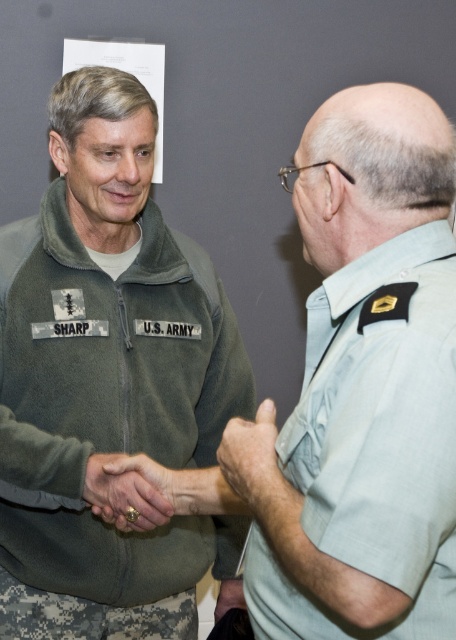
You are a photographer taking a closeup shot of the handshake between the two individuals. You need to focus on the gold ring at center and the matte gray hand at lower center. Which object is closer to the camera lens?

The gold ring at center is shorter than the matte gray hand at lower center, so the gold ring at center is closer to the camera lens.

You are standing in front of the image and want to determine which of the two points, point (340, 312) or point (133, 500), is nearer to you. Based on the spatial relationship between them, which point is closer?

Point (340, 312) is closer to the viewer than point (133, 500).